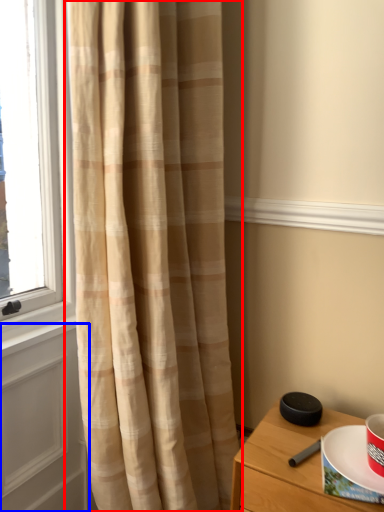
Question: Which of the following is the closest to the observer, curtain (highlighted by a red box) or screen door (highlighted by a blue box)?

Choices:
 (A) curtain
 (B) screen door

Answer: (A)